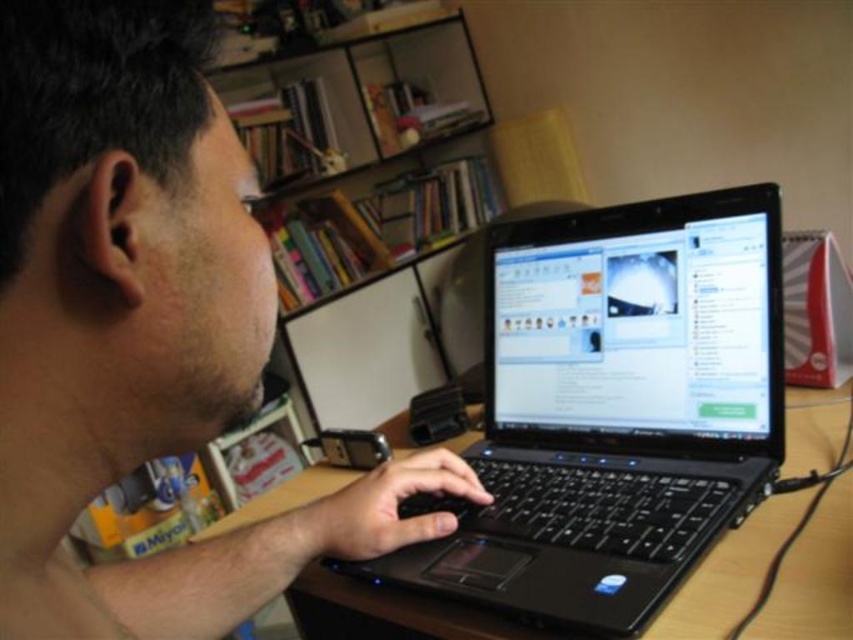
You are a delivery robot that needs to place a small package between the matte black laptop at center and the whiteboard leaning against the wall. The package is 10 inches long. Can you fit it there?

The distance between the matte black laptop at center and the whiteboard leaning against the wall is 9.25 inches, so the 10 inch package is too long to fit between them.

You are a delivery robot with a package that measures 24 centimeters in length. You need to place the package between the matte black laptop at center and the wooden table at center. Is there enough space for the package to fit between them?

The distance between the matte black laptop at center and the wooden table at center is 24.54 centimeters. Since the package is 24 centimeters long, there is enough space for it to fit between them.

You are trying to clean the desk and need to move the black plastic laptop at center and the shiny black laptop screen at center. Which object should you move first if you want to access the one underneath?

You should move the black plastic laptop at center first because it is located below the shiny black laptop screen at center, meaning the shiny black laptop screen is on top and the black plastic laptop is underneath. To access what is underneath the black plastic laptop at center, you need to move it first.